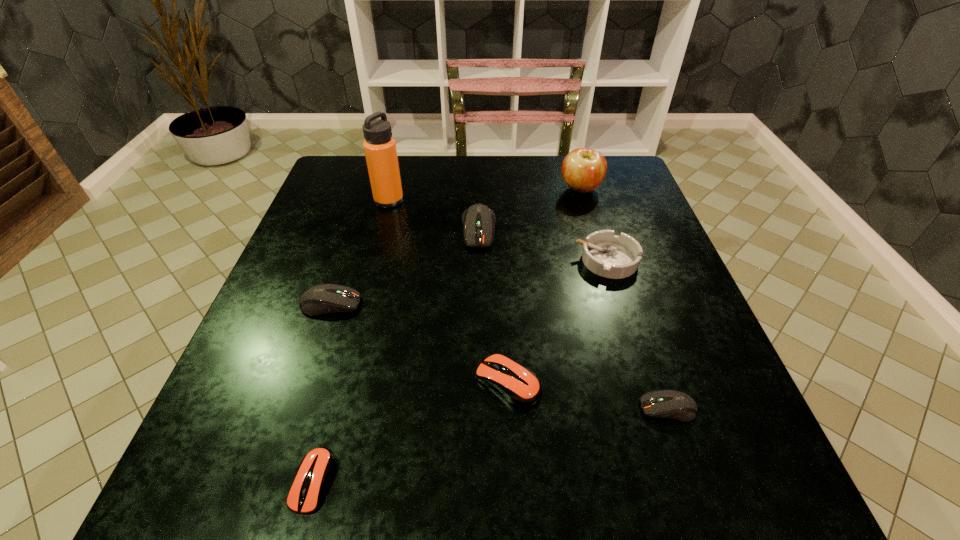
Find the location of `vacant space at the near right corner of the desktop`. vacant space at the near right corner of the desktop is located at coordinates (740, 460).

At what (x,y) coordinates should I click in order to perform the action: click on vacant space in between the thermos bottle and the fourth shortest computer mouse. Please return your answer as a coordinate pair (x, y). Image resolution: width=960 pixels, height=540 pixels. Looking at the image, I should click on (360, 252).

This screenshot has height=540, width=960. Find the location of `vacant space that's between the farthest computer mouse and the second tallest object`. vacant space that's between the farthest computer mouse and the second tallest object is located at coordinates [x=530, y=210].

Where is `free spot between the fourth shortest computer mouse and the orange thermos bottle`? The height and width of the screenshot is (540, 960). free spot between the fourth shortest computer mouse and the orange thermos bottle is located at coordinates (360, 252).

You are a GUI agent. You are given a task and a screenshot of the screen. Output one action in this format:
    pyautogui.click(x=<x>, y=<y>)
    Task: Click on the vacant area between the ashtray and the third tallest object
    The width and height of the screenshot is (960, 540).
    Given the screenshot: What is the action you would take?
    pyautogui.click(x=543, y=245)

Locate an element on the screen. This screenshot has height=540, width=960. vacant space that's between the biggest dark computer equipment and the leftmost dark computer equipment is located at coordinates (404, 267).

This screenshot has height=540, width=960. Find the location of `empty space that is in between the farther orange computer mouse and the apple`. empty space that is in between the farther orange computer mouse and the apple is located at coordinates (544, 286).

The width and height of the screenshot is (960, 540). Identify the location of vacant area that lies between the ashtray and the tallest computer mouse. (543, 245).

Where is `empty space between the second tallest object and the nearest object`? This screenshot has width=960, height=540. empty space between the second tallest object and the nearest object is located at coordinates (447, 335).

This screenshot has width=960, height=540. Identify the location of vacant region between the ashtray and the orange thermos bottle. (498, 230).